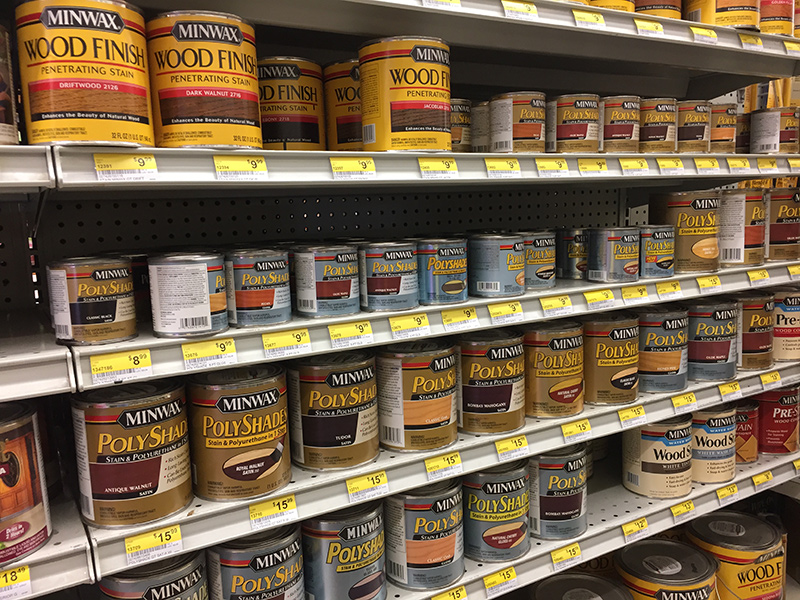
This screenshot has height=600, width=800. Identify the location of cans on bottom shelf. (586, 592), (668, 575), (745, 538).